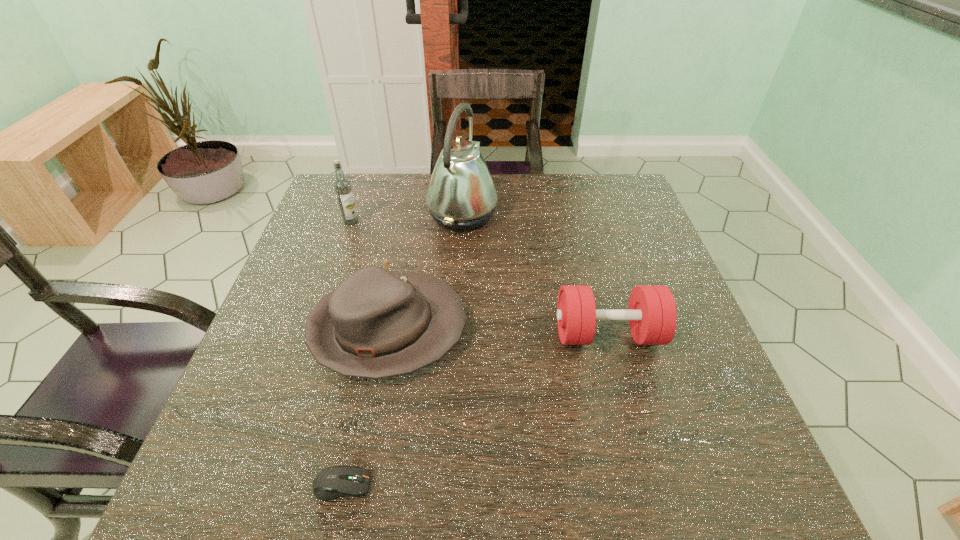
You are a GUI agent. You are given a task and a screenshot of the screen. Output one action in this format:
    pyautogui.click(x=<x>, y=<y>)
    Task: Click on the free spot located 0.370m on the button of the nearest object
    
    Given the screenshot: What is the action you would take?
    pyautogui.click(x=598, y=484)

Where is `kettle that is at the far edge`? The width and height of the screenshot is (960, 540). kettle that is at the far edge is located at coordinates (461, 195).

Where is `vodka positioned at the far edge`? vodka positioned at the far edge is located at coordinates tap(342, 186).

Find the location of `object at the near edge`. object at the near edge is located at coordinates (333, 482).

Where is `vodka that is at the left edge`? Image resolution: width=960 pixels, height=540 pixels. vodka that is at the left edge is located at coordinates (342, 186).

The width and height of the screenshot is (960, 540). Find the location of `hat that is at the left edge`. hat that is at the left edge is located at coordinates (376, 324).

Locate an element on the screen. This screenshot has width=960, height=540. object situated at the right edge is located at coordinates (652, 315).

Image resolution: width=960 pixels, height=540 pixels. I want to click on object that is at the far left corner, so click(x=342, y=186).

Find the location of a particular element. vacant area at the far edge of the desktop is located at coordinates (380, 204).

In the image, there is a desktop. Find the location of `vacant space at the near edge`. vacant space at the near edge is located at coordinates (356, 460).